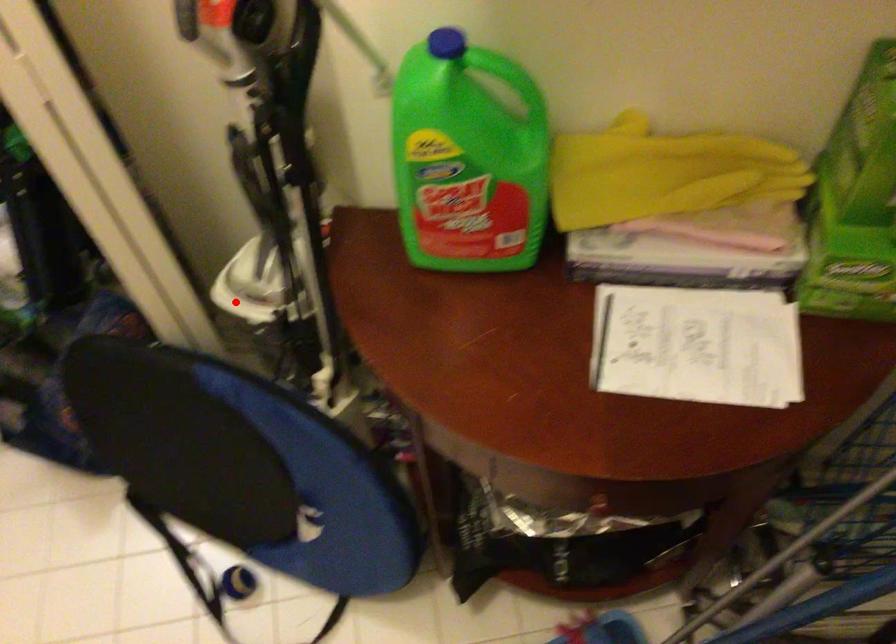
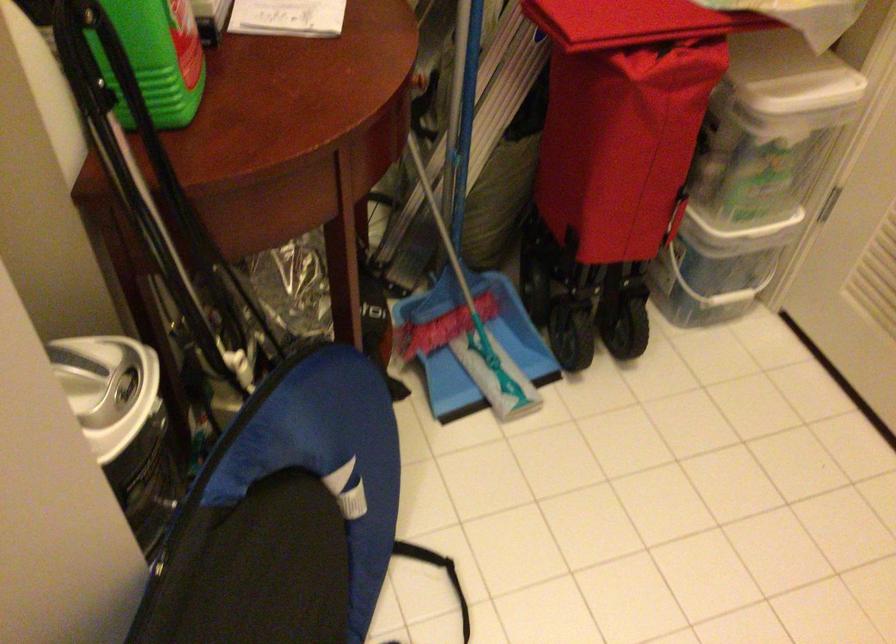
The point at the highlighted location is marked in the first image. Where is the corresponding point in the second image?

(123, 424)